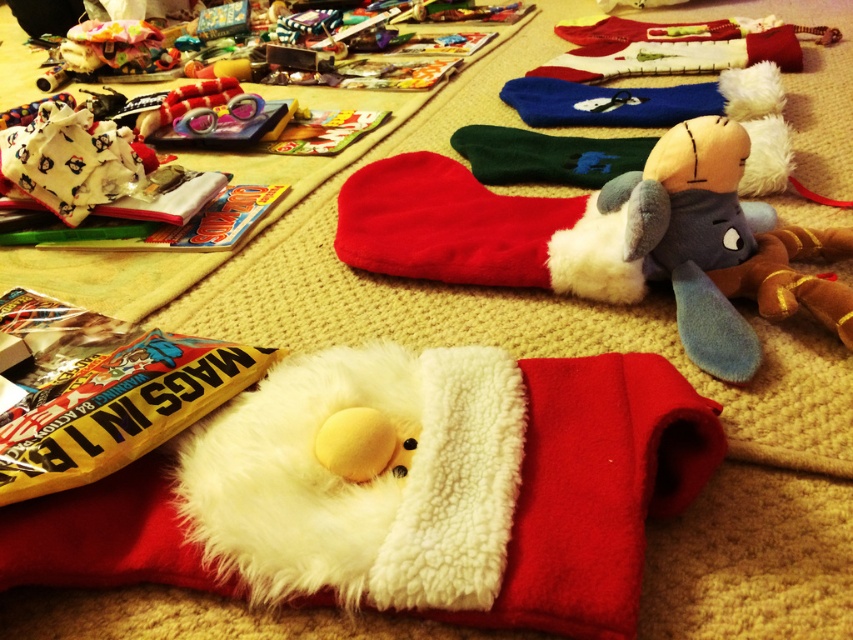
You are standing in the living room and want to take a photo of the blue plush toy at upper right with your camera. The camera has a minimum focusing distance of 36 inches. Can you take a clear photo without moving either the camera or the toy?

The blue plush toy at upper right and camera are 37.44 inches apart from each other. Since the minimum focusing distance is 36 inches, the camera can focus on the blue plush toy at upper right as the distance is within the required range. Therefore, you can take a clear photo without moving either the camera or the toy.

You are a child trying to reach the blue plush toy at upper right from the red plush sock at center. Can you grab it without moving anything else?

The distance between blue plush toy at upper right and red plush sock at center is 7.32 inches, so yes, you can reach it without moving anything else if your hand can extend that far.

You are organizing a childrens party and need to arrange the blue plush toy at upper right and the red plush sock at center on a shelf. Which toy requires a wider space on the shelf?

The red plush sock at center requires a wider space on the shelf because it has a greater width compared to the blue plush toy at upper right.